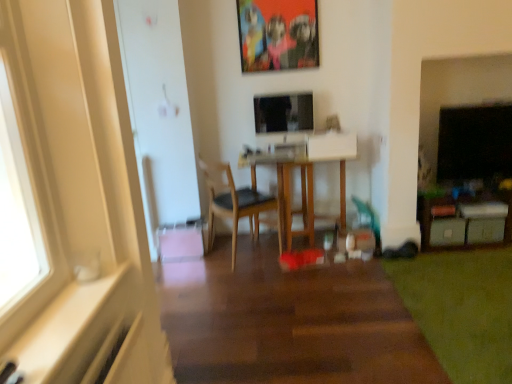
Question: Considering the positions of green soft carpet at lower right and white plastic drawer at lower right, the 2th drawer when ordered from left to right, in the image, is green soft carpet at lower right taller or shorter than white plastic drawer at lower right, the 2th drawer when ordered from left to right,?

Choices:
 (A) short
 (B) tall

Answer: (A)

Question: From a real-world perspective, is green soft carpet at lower right positioned above or below white plastic drawer at lower right, the 2th drawer when ordered from left to right?

Choices:
 (A) below
 (B) above

Answer: (A)

Question: Estimate the real-world distances between objects in this image. Which object is farther from the matte plastic picture frame at upper center?

Choices:
 (A) satin black monitor at center
 (B) green matte drawer at lower right, acting as the 2th drawer starting from the right
 (C) wooden table at center
 (D) wooden chair at center
 (E) green soft carpet at lower right

Answer: (E)

Question: Considering the real-world distances, which object is farthest from the green soft carpet at lower right?

Choices:
 (A) wooden chair at center
 (B) white plastic drawer at lower right, the 2th drawer when ordered from left to right
 (C) satin black monitor at center
 (D) wooden table at center
 (E) matte plastic picture frame at upper center

Answer: (E)